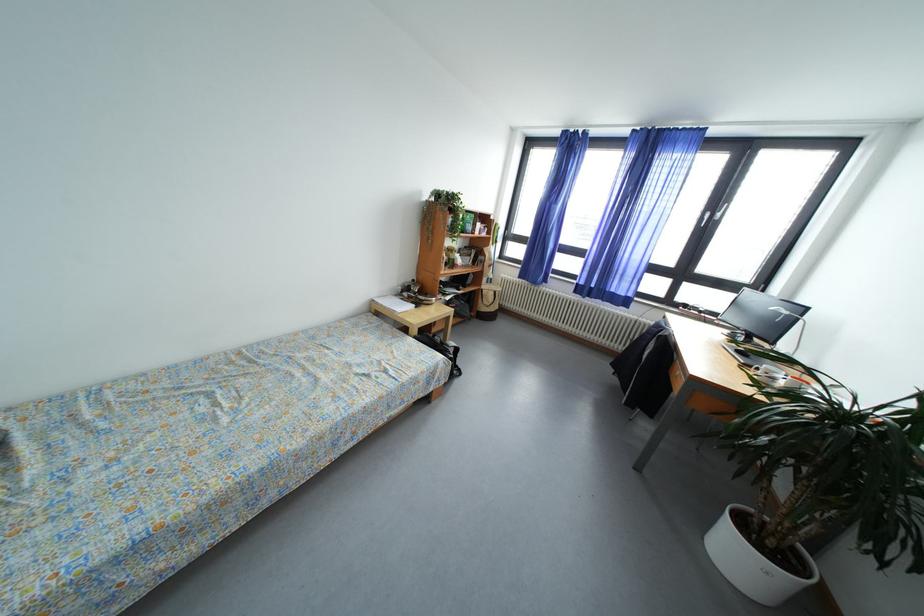
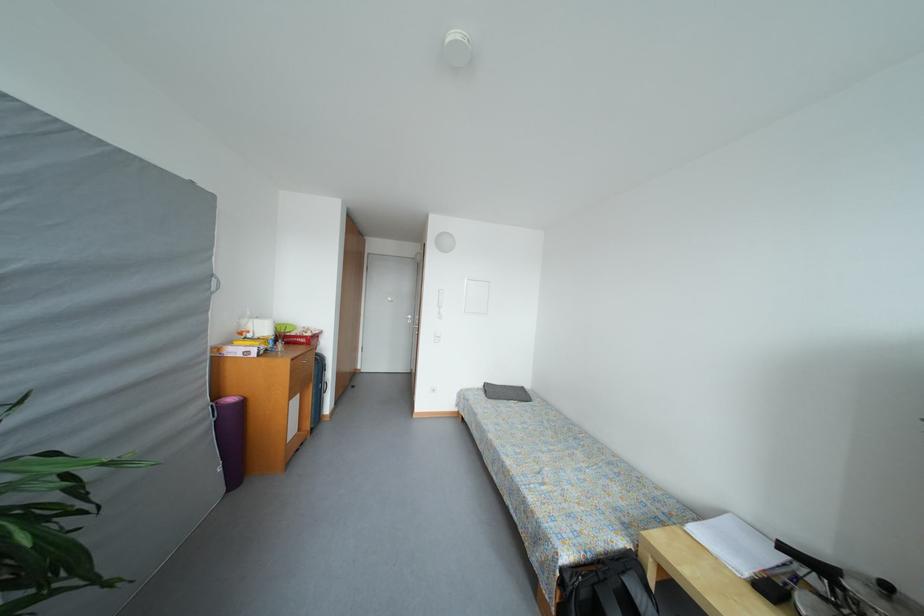
Locate, in the second image, the point that corresponds to pixel 302 448 in the first image.

(496, 440)